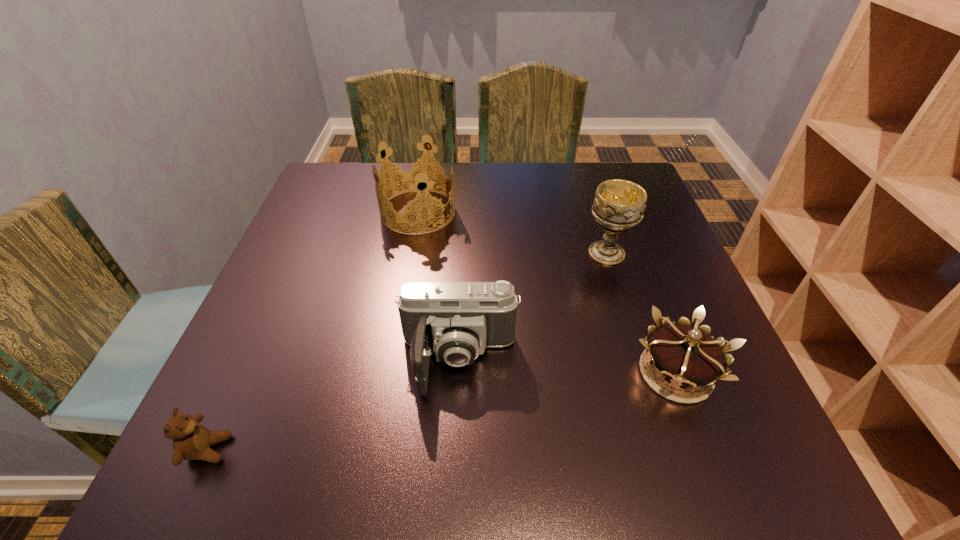
Find the location of a particular element. The height and width of the screenshot is (540, 960). free space that is in between the left crown and the chalice is located at coordinates (513, 232).

Locate an element on the screen. The height and width of the screenshot is (540, 960). blank region between the second shortest object and the shortest object is located at coordinates (442, 411).

What are the coordinates of `vacant space in between the right crown and the farther crown` in the screenshot? It's located at click(547, 292).

Identify the location of vacant space that is in between the farthest object and the nearer crown. (547, 292).

Identify the location of vacant space that's between the nearest object and the chalice. (407, 351).

The height and width of the screenshot is (540, 960). What are the coordinates of `vacant area between the chalice and the third shortest object` in the screenshot? It's located at (533, 307).

Locate which object ranks fourth in proximity to the second shortest object. Please provide its 2D coordinates. Your answer should be formatted as a tuple, i.e. [(x, y)], where the tuple contains the x and y coordinates of a point satisfying the conditions above.

[(191, 440)]

Locate an element on the screen. The height and width of the screenshot is (540, 960). the third closest object to the second farthest object is located at coordinates (413, 174).

This screenshot has height=540, width=960. In order to click on vacant space that satisfies the following two spatial constraints: 1. at the front of the nearer crown with an open lens cover; 2. on the left side of the third shortest object in this screenshot , I will do `click(458, 373)`.

Find the location of `vacant area that satisfies the following two spatial constraints: 1. at the front of the right crown with an open lens cover; 2. on the left side of the camera`. vacant area that satisfies the following two spatial constraints: 1. at the front of the right crown with an open lens cover; 2. on the left side of the camera is located at coordinates (458, 373).